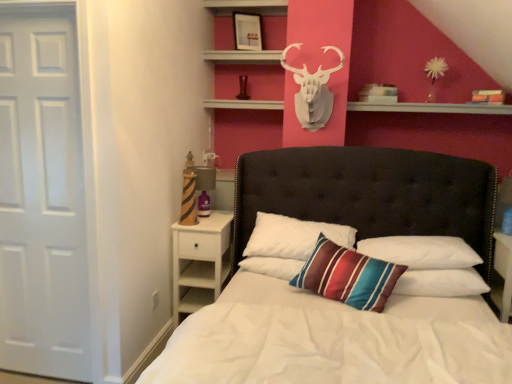
Question: From a real-world perspective, is white matte/decorative deer head at upper center positioned above or below white matte door at left?

Choices:
 (A) below
 (B) above

Answer: (B)

Question: Is white matte/decorative deer head at upper center to the left or to the right of white matte door at left in the image?

Choices:
 (A) right
 (B) left

Answer: (A)

Question: Considering the real-world distances, which object is farthest from the white soft pillow at center, placed as the third pillow when sorted from right to left?

Choices:
 (A) matte black picture frame at upper center
 (B) white wood nightstand at lower left
 (C) striped fabric pillow at center, marked as the 3th pillow in a left-to-right arrangement
 (D) white tufted headboard at center
 (E) white matte/decorative deer head at upper center

Answer: (A)

Question: Which object is the farthest from the white tufted headboard at center?

Choices:
 (A) white matte/decorative deer head at upper center
 (B) striped fabric pillow at center, marked as the 3th pillow in a left-to-right arrangement
 (C) striped fabric pillow at center, the 2th pillow from the left
 (D) white soft pillow at center, placed as the third pillow when sorted from right to left
 (E) white matte door at left

Answer: (E)